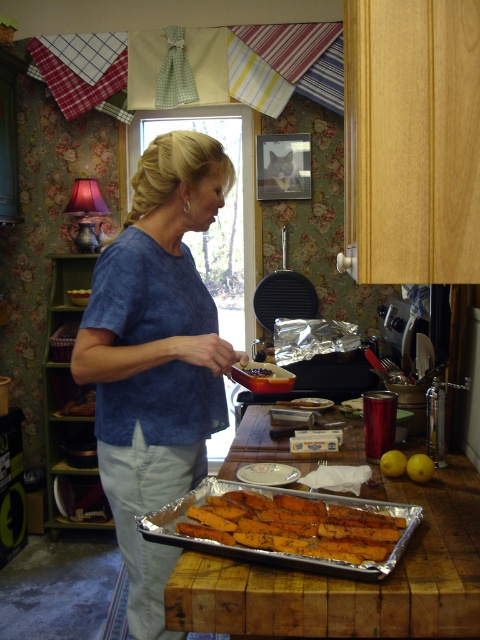
You are a chef trying to locate the golden brown crispy sticks at lower center on the counter. According to the coordinates provided, where exactly should you look for them?

The golden brown crispy sticks at lower center are located at point (x=294, y=525), so you should look there on the counter.

You are a chef who needs to serve a dish. You have the golden brown crispy sticks at lower center and the white glossy platter at center. Which item is larger in size?

The golden brown crispy sticks at lower center is bigger than the white glossy platter at center.

Based on the scene description, where is the white glossy platter at center located in terms of coordinates?

Answer: The white glossy platter at center is located at coordinates point (x=267, y=474).